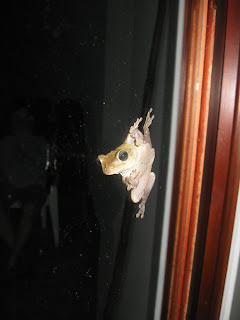
You are a GUI agent. You are given a task and a screenshot of the screen. Output one action in this format:
    pyautogui.click(x=<x>, y=<y>)
    Task: Click on the molding
    This screenshot has width=240, height=320.
    Given the screenshot: What is the action you would take?
    pyautogui.click(x=204, y=79), pyautogui.click(x=196, y=242)